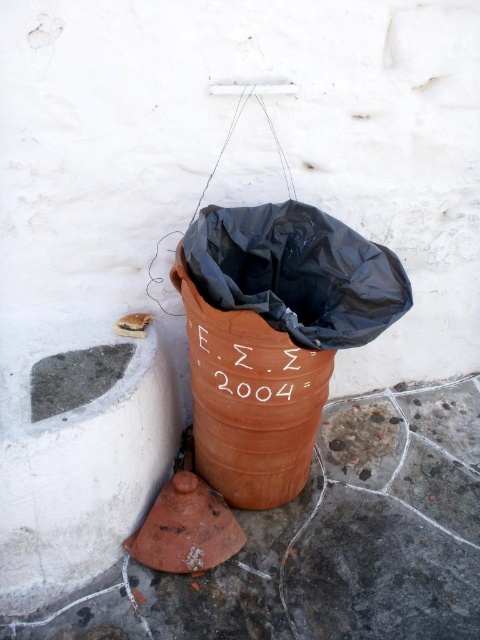
You are standing on the smooth concrete pavement at lower left and want to throw a piece of paper into the terracotta textured barrel at center. Which direction should you move to reach the barrel?

The smooth concrete pavement at lower left is to the right of the terracotta textured barrel at center, so you should move to your left to reach the barrel.

You are standing in a parking lot and see the smooth concrete pavement at lower left and the terracotta textured barrel at center. Which surface would you choose to place a heavy box to avoid it sinking into the ground? Explain your choice based on their heights.

The smooth concrete pavement at lower left is not as tall as the terracotta textured barrel at center, so placing the heavy box on the terracotta textured barrel at center would prevent it from sinking into the ground since it is elevated higher than the pavement.

You are standing in a parking lot and see the smooth concrete pavement at lower left and the terracotta textured barrel at center. Which surface would you step on first if you walk towards the barrel?

You would step on the smooth concrete pavement at lower left first because it is closer to you than the terracotta textured barrel at center.